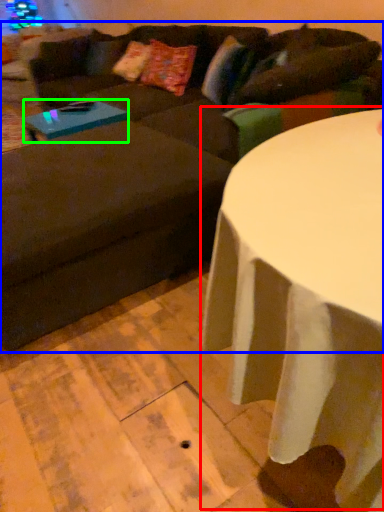
Question: Which object is positioned closest to table (highlighted by a red box)? Select from studio couch (highlighted by a blue box) and coffee table (highlighted by a green box).

Choices:
 (A) studio couch
 (B) coffee table

Answer: (A)